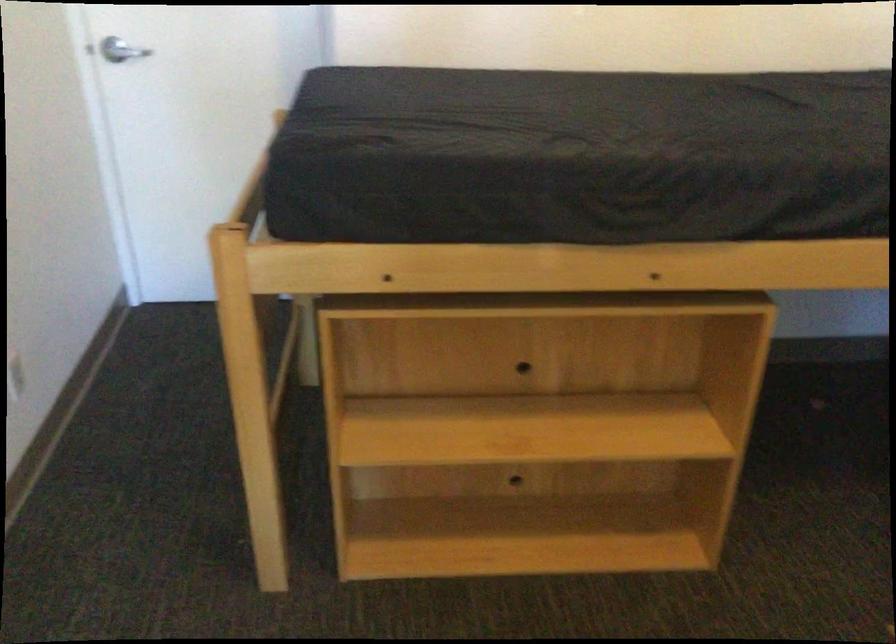
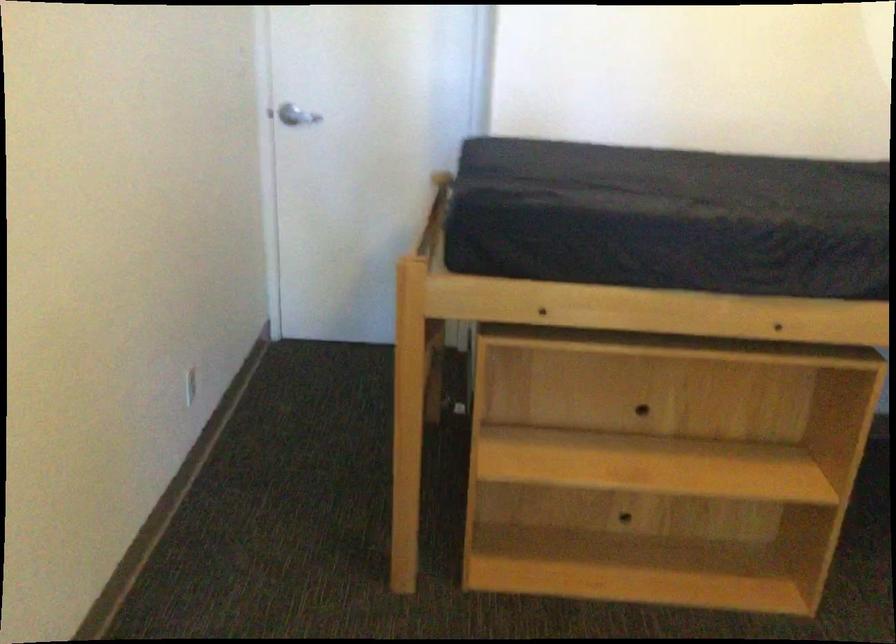
Locate, in the second image, the point that corresponds to pixel 513 480 in the first image.

(623, 518)